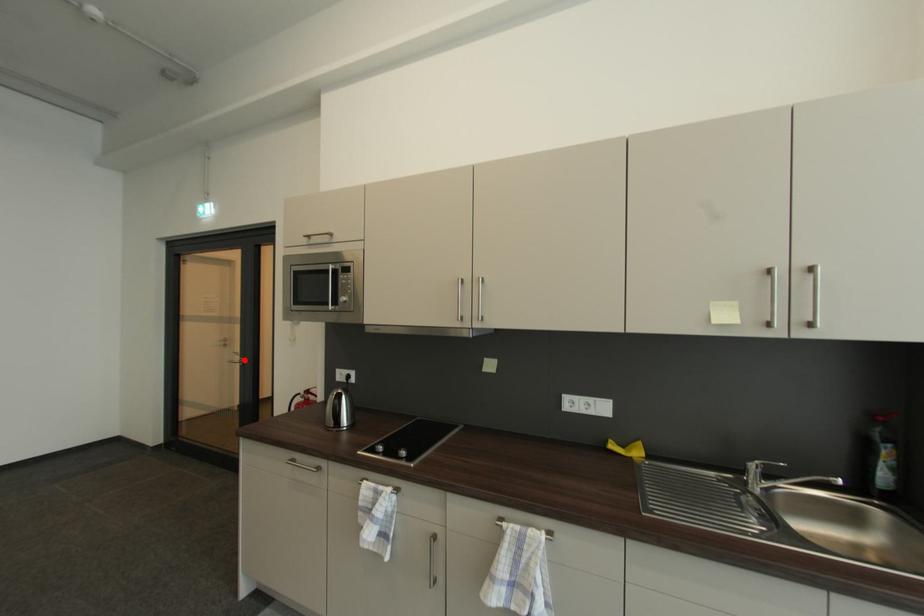
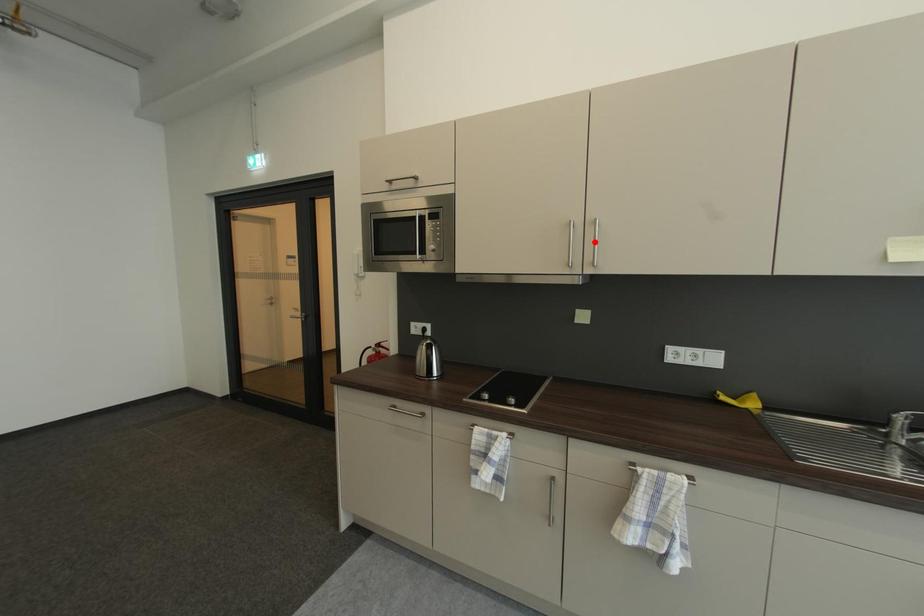
I am providing you with two images of the same scene from different viewpoints. A red point is marked on the first image and another point is marked on the second image. Is the marked point in image1 the same physical position as the marked point in image2?

No